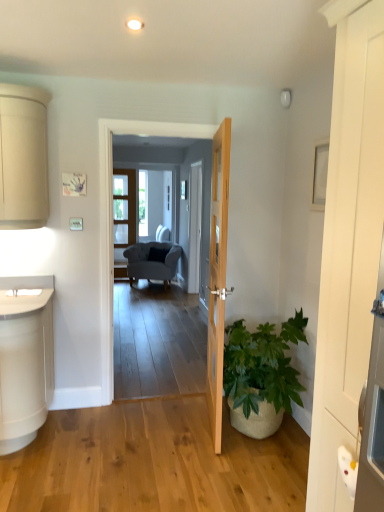
What do you see at coordinates (262, 366) in the screenshot? I see `green leafy plant in woven basket at lower right` at bounding box center [262, 366].

Locate an element on the screen. The width and height of the screenshot is (384, 512). green leafy plant in woven basket at lower right is located at coordinates (262, 366).

Find the location of a particular element. Image resolution: width=384 pixels, height=512 pixels. clear glass screen door at center is located at coordinates (123, 216).

This screenshot has height=512, width=384. Describe the element at coordinates (113, 205) in the screenshot. I see `smooth gray carpet at center` at that location.

You are a GUI agent. You are given a task and a screenshot of the screen. Output one action in this format:
    pyautogui.click(x=<x>, y=<y>)
    Task: Click on the white wooden door at right, placed as the 2th door when sorted from back to front
    This screenshot has width=384, height=512.
    Given the screenshot: What is the action you would take?
    pyautogui.click(x=348, y=248)

Locate an element on the screen. Image resolution: width=384 pixels, height=512 pixels. green leafy plant in woven basket at lower right is located at coordinates (262, 366).

Can you confirm if smooth gray carpet at center is taller than clear glass screen door at center?

Indeed, smooth gray carpet at center has a greater height compared to clear glass screen door at center.

From the image's perspective, is smooth gray carpet at center positioned above or below clear glass screen door at center?

smooth gray carpet at center is situated lower than clear glass screen door at center in the image.

Is smooth gray carpet at center wider than clear glass screen door at center?

Indeed, smooth gray carpet at center has a greater width compared to clear glass screen door at center.

In the scene shown: Which is more to the left, natural wood door at center, which is counted as the 1th door, starting from the left, or white wooden door at right, the second door viewed from the left?

natural wood door at center, which is counted as the 1th door, starting from the left, is more to the left.

From the image's perspective, which is below, natural wood door at center, which is the second door from front to back, or white wooden door at right, the second door viewed from the left?

natural wood door at center, which is the second door from front to back.

Who is more distant, natural wood door at center, which is counted as the 1th door, starting from the left, or white wooden door at right, the second door viewed from the left?

natural wood door at center, which is counted as the 1th door, starting from the left, is further away from the camera.

Would you consider natural wood door at center, which is counted as the 1th door, starting from the left, to be distant from white wooden door at right, the 1th door in the right-to-left sequence?

Indeed, natural wood door at center, which is counted as the 1th door, starting from the left, is not near white wooden door at right, the 1th door in the right-to-left sequence.

Does white wooden door at right, the second door viewed from the left, have a lesser width compared to green leafy plant in woven basket at lower right?

Indeed, white wooden door at right, the second door viewed from the left, has a lesser width compared to green leafy plant in woven basket at lower right.

This screenshot has height=512, width=384. I want to click on door that is the 2nd one above the green leafy plant in woven basket at lower right (from a real-world perspective), so click(x=348, y=248).

Does white wooden door at right, the 1th door in the right-to-left sequence, contain green leafy plant in woven basket at lower right?

Actually, green leafy plant in woven basket at lower right is outside white wooden door at right, the 1th door in the right-to-left sequence.

From a real-world perspective, is white wooden door at right, which appears as the 1th door when viewed from the front, under green leafy plant in woven basket at lower right?

Actually, white wooden door at right, which appears as the 1th door when viewed from the front, is physically above green leafy plant in woven basket at lower right in the real world.

Which object is further away from the camera, natural wood door at center, which is counted as the 1th door, starting from the left, or smooth gray carpet at center?

smooth gray carpet at center.

From a real-world perspective, which is physically above, natural wood door at center, positioned as the second door in right-to-left order, or smooth gray carpet at center?

smooth gray carpet at center.

Which object is closer to the camera, clear glass screen door at center or suede gray armchair at center?

→ suede gray armchair at center is in front.

Is clear glass screen door at center facing towards suede gray armchair at center?

No, clear glass screen door at center is not aimed at suede gray armchair at center.

Which point is more distant from viewer, (119, 212) or (130, 272)?

The point (119, 212) is more distant.

From the image's perspective, does clear glass screen door at center appear higher than suede gray armchair at center?

Yes.

Considering the sizes of white wooden door at right, placed as the 2th door when sorted from back to front, and natural wood door at center, which is the second door from front to back, in the image, is white wooden door at right, placed as the 2th door when sorted from back to front, wider or thinner than natural wood door at center, which is the second door from front to back,?

white wooden door at right, placed as the 2th door when sorted from back to front, is thinner than natural wood door at center, which is the second door from front to back.

Could you tell me if white wooden door at right, placed as the 2th door when sorted from back to front, is turned towards natural wood door at center, which is the second door from front to back?

No, white wooden door at right, placed as the 2th door when sorted from back to front, is not oriented towards natural wood door at center, which is the second door from front to back.

Which is more to the left, white wooden door at right, the second door viewed from the left, or natural wood door at center, positioned as the second door in right-to-left order?

From the viewer's perspective, natural wood door at center, positioned as the second door in right-to-left order, appears more on the left side.

From a real-world perspective, is white wooden door at right, which appears as the 1th door when viewed from the front, under natural wood door at center, which is the second door from front to back?

No, from a real-world perspective, white wooden door at right, which appears as the 1th door when viewed from the front, is not under natural wood door at center, which is the second door from front to back.

Find the location of `screen door located on the left of natural wood door at center, which is counted as the 1th door, starting from the left`. screen door located on the left of natural wood door at center, which is counted as the 1th door, starting from the left is located at coordinates (123, 216).

From a real-world perspective, is clear glass screen door at center positioned above or below natural wood door at center, which is counted as the 1th door, starting from the left?

In terms of real-world spatial position, clear glass screen door at center is above natural wood door at center, which is counted as the 1th door, starting from the left.

In the scene shown: Which of these two, clear glass screen door at center or natural wood door at center, which is the second door from front to back, is smaller?

Smaller between the two is clear glass screen door at center.

This screenshot has width=384, height=512. In order to click on corridor lying below the clear glass screen door at center (from the image's perspective) in this screenshot , I will do `click(113, 205)`.

Identify the location of door in front of the natural wood door at center, which is counted as the 1th door, starting from the left. The width and height of the screenshot is (384, 512). (348, 248).

Considering their positions, is white wooden door at right, the second door viewed from the left, positioned further to green leafy plant in woven basket at lower right than suede gray armchair at center?

suede gray armchair at center is further to green leafy plant in woven basket at lower right.

Looking at the image, which one is located closer to green leafy plant in woven basket at lower right, suede gray armchair at center or natural wood door at center, which ranks as the first door in back-to-front order?

natural wood door at center, which ranks as the first door in back-to-front order, lies closer to green leafy plant in woven basket at lower right than the other object.

From the image, which object appears to be nearer to white wooden door at right, the second door viewed from the left, green leafy plant in woven basket at lower right or natural wood door at center, positioned as the second door in right-to-left order?

natural wood door at center, positioned as the second door in right-to-left order, is closer to white wooden door at right, the second door viewed from the left.

From the image, which object appears to be farther from green leafy plant in woven basket at lower right, white wooden door at right, the 1th door in the right-to-left sequence, or natural wood door at center, which ranks as the first door in back-to-front order?

white wooden door at right, the 1th door in the right-to-left sequence.

Which object lies nearer to the anchor point smooth gray carpet at center, white wooden door at right, which appears as the 1th door when viewed from the front, or green leafy plant in woven basket at lower right?

Among the two, green leafy plant in woven basket at lower right is located nearer to smooth gray carpet at center.

When comparing their distances from clear glass screen door at center, does natural wood door at center, which is the second door from front to back, or smooth gray carpet at center seem closer?

smooth gray carpet at center is closer to clear glass screen door at center.

Based on their spatial positions, is smooth gray carpet at center or clear glass screen door at center further from suede gray armchair at center?

smooth gray carpet at center is further to suede gray armchair at center.

Based on their spatial positions, is suede gray armchair at center or white wooden door at right, the 1th door in the right-to-left sequence, further from clear glass screen door at center?

white wooden door at right, the 1th door in the right-to-left sequence, lies further to clear glass screen door at center than the other object.

Identify the location of houseplant positioned between white wooden door at right, which appears as the 1th door when viewed from the front, and clear glass screen door at center from near to far. This screenshot has height=512, width=384. (262, 366).

Find the location of a particular element. corridor between natural wood door at center, which is the second door from front to back, and clear glass screen door at center in the front-back direction is located at coordinates 113,205.

Identify the location of door between white wooden door at right, which appears as the 1th door when viewed from the front, and green leafy plant in woven basket at lower right from front to back. (218, 276).

At what (x,y) coordinates should I click in order to perform the action: click on corridor between white wooden door at right, the second door viewed from the left, and suede gray armchair at center in the front-back direction. Please return your answer as a coordinate pair (x, y). The height and width of the screenshot is (512, 384). Looking at the image, I should click on (113, 205).